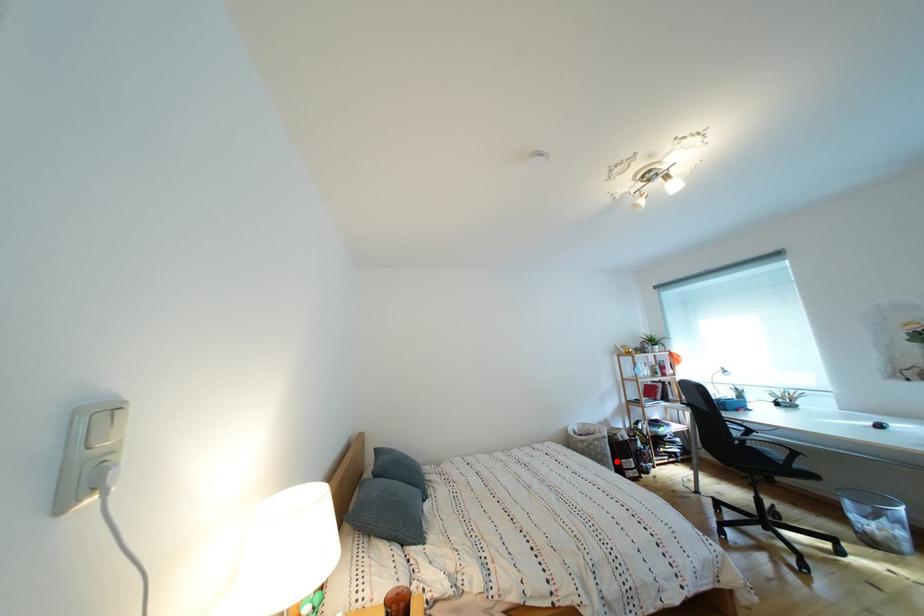
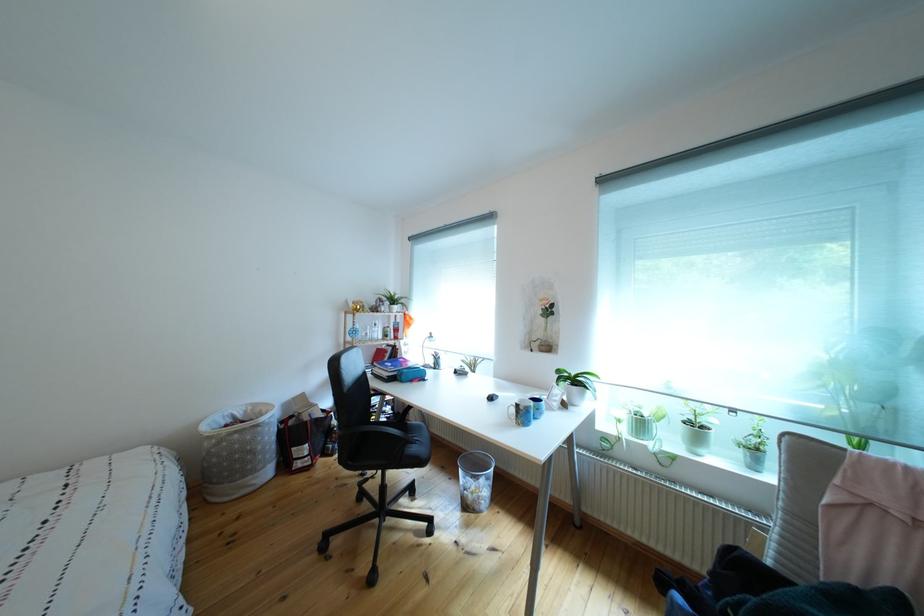
Question: I am providing you with two images of the same scene from different viewpoints. A red point is marked on the first image. Is the red point's position out of view in image 2?

Choices:
 (A) Yes
 (B) No

Answer: (B)